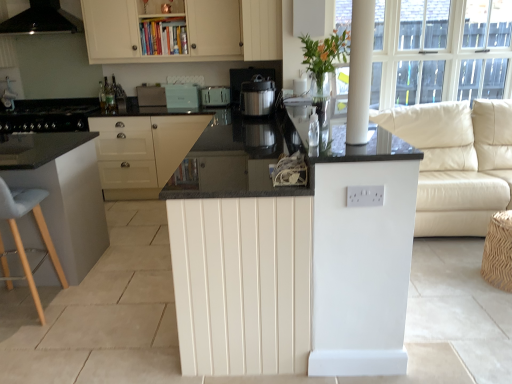
You are a GUI agent. You are given a task and a screenshot of the screen. Output one action in this format:
    pyautogui.click(x=<x>, y=<y>)
    Task: Click on the white glossy pillar at upper right
    The width and height of the screenshot is (512, 384).
    Given the screenshot: What is the action you would take?
    pyautogui.click(x=360, y=71)

Image resolution: width=512 pixels, height=384 pixels. What do you see at coordinates (257, 96) in the screenshot? I see `metallic silver coffee maker at center` at bounding box center [257, 96].

What do you see at coordinates (182, 96) in the screenshot?
I see `teal matte toaster at upper center, which ranks as the 3th appliance in left-to-right order` at bounding box center [182, 96].

This screenshot has height=384, width=512. I want to click on black glass stove at left, which ranks as the first appliance in left-to-right order, so click(48, 115).

Identify the location of brown woven stool at lower right, positioned as the 2th bar stool in left-to-right order. (498, 251).

Does translucent glass vase at upper center lie in front of white wood cabinet at upper center, the second cabinetry positioned from the top?

Yes, the depth of translucent glass vase at upper center is less than that of white wood cabinet at upper center, the second cabinetry positioned from the top.

Which is further, (x=345, y=30) or (x=268, y=28)?

The point (x=268, y=28) is farther.

In the scene shown: Would you say translucent glass vase at upper center is to the left or to the right of white wood cabinet at upper center, positioned as the 2th cabinetry in bottom-to-top order, in the picture?

translucent glass vase at upper center is to the right of white wood cabinet at upper center, positioned as the 2th cabinetry in bottom-to-top order.

From the image's perspective, between white glossy pillar at upper right and black glass stove at left, acting as the 4th appliance starting from the right, who is located below?

white glossy pillar at upper right appears lower in the image.

In the scene shown: Which object is positioned more to the left, white glossy pillar at upper right or black glass stove at left, which ranks as the first appliance in left-to-right order?

Positioned to the left is black glass stove at left, which ranks as the first appliance in left-to-right order.

Are white glossy pillar at upper right and black glass stove at left, which ranks as the first appliance in left-to-right order, beside each other?

No, white glossy pillar at upper right is not in contact with black glass stove at left, which ranks as the first appliance in left-to-right order.

Does white glossy pillar at upper right have a lesser height compared to black glass stove at left, acting as the 4th appliance starting from the right?

No, white glossy pillar at upper right is not shorter than black glass stove at left, acting as the 4th appliance starting from the right.

Is teal matte toaster at upper center, positioned as the second appliance in right-to-left order, outside of satin silver toaster at center, acting as the 4th appliance starting from the left?

Yes, teal matte toaster at upper center, positioned as the second appliance in right-to-left order, is outside of satin silver toaster at center, acting as the 4th appliance starting from the left.

Between teal matte toaster at upper center, positioned as the second appliance in right-to-left order, and satin silver toaster at center, acting as the 4th appliance starting from the left, which one has more height?

With more height is teal matte toaster at upper center, positioned as the second appliance in right-to-left order.

Looking at this image, from the image's perspective, which is below, teal matte toaster at upper center, positioned as the second appliance in right-to-left order, or satin silver toaster at center, which is counted as the 1th appliance, starting from the right?

From the image's view, satin silver toaster at center, which is counted as the 1th appliance, starting from the right, is below.

Considering the points (169, 92) and (209, 88), which point is behind, point (169, 92) or point (209, 88)?

The point (209, 88) is farther from the camera.

Does white glossy counter at center have a greater width compared to white plastic toaster at upper center, which ranks as the second appliance in left-to-right order?

Yes, white glossy counter at center is wider than white plastic toaster at upper center, which ranks as the second appliance in left-to-right order.

Considering the points (207, 344) and (162, 98), which point is behind, point (207, 344) or point (162, 98)?

Positioned behind is point (162, 98).

Is white glossy counter at center located outside white plastic toaster at upper center, which ranks as the second appliance in left-to-right order?

Yes, white glossy counter at center is located beyond the bounds of white plastic toaster at upper center, which ranks as the second appliance in left-to-right order.

From a real-world perspective, is white glossy pillar at upper right on top of white leather couch at right?

Yes, from a real-world perspective, white glossy pillar at upper right is on top of white leather couch at right.

Is white glossy pillar at upper right bigger or smaller than white leather couch at right?

In the image, white glossy pillar at upper right appears to be smaller than white leather couch at right.

Based on the photo, is the position of white glossy pillar at upper right more distant than that of white leather couch at right?

No, the depth of white glossy pillar at upper right is less than that of white leather couch at right.

Which is closer, [352,28] or [453,207]?

Clearly, point [352,28] is closer to the camera than point [453,207].

How many degrees apart are the facing directions of translucent glass vase at upper center and black matte range hood at upper left?

The angular difference between translucent glass vase at upper center and black matte range hood at upper left is 90.7 degrees.

Is translucent glass vase at upper center inside or outside of black matte range hood at upper left?

translucent glass vase at upper center is outside black matte range hood at upper left.

Find the location of `plant that appears in front of the black matte range hood at upper left`. plant that appears in front of the black matte range hood at upper left is located at coordinates (323, 55).

Is translucent glass vase at upper center bigger or smaller than black matte range hood at upper left?

translucent glass vase at upper center is smaller than black matte range hood at upper left.

Based on the photo, is light blue fabric stool at left, which is the first bar stool in left-to-right order, far away from white glossy pillar at upper right?

Absolutely, light blue fabric stool at left, which is the first bar stool in left-to-right order, is distant from white glossy pillar at upper right.

Is white glossy pillar at upper right a part of light blue fabric stool at left, which is the first bar stool in left-to-right order?

Actually, white glossy pillar at upper right is outside light blue fabric stool at left, which is the first bar stool in left-to-right order.

From the image's perspective, which one is positioned higher, light blue fabric stool at left, which is counted as the second bar stool, starting from the right, or white glossy pillar at upper right?

From the image's view, white glossy pillar at upper right is above.

Does light blue fabric stool at left, which is counted as the second bar stool, starting from the right, lie behind white glossy pillar at upper right?

Yes, light blue fabric stool at left, which is counted as the second bar stool, starting from the right, is further from the viewer.

Locate an element on the screen. the 1st cabinetry directly above the translucent glass vase at upper center (from a real-world perspective) is located at coordinates (261, 29).

Locate an element on the screen. The image size is (512, 384). the 1st appliance behind the white glossy pillar at upper right is located at coordinates (48, 115).

Based on their spatial positions, is white leather couch at right or satin silver toaster at center, which is counted as the 1th appliance, starting from the right, further from brown woven stool at lower right, positioned as the 2th bar stool in left-to-right order?

satin silver toaster at center, which is counted as the 1th appliance, starting from the right, lies further to brown woven stool at lower right, positioned as the 2th bar stool in left-to-right order, than the other object.

When comparing their distances from white matte cabinet at center, the 1th cabinetry in the bottom-to-top sequence, does teal matte toaster at upper center, positioned as the second appliance in right-to-left order, or white plastic toaster at upper center, which ranks as the second appliance in left-to-right order, seem further?

Among the two, teal matte toaster at upper center, positioned as the second appliance in right-to-left order, is located further to white matte cabinet at center, the 1th cabinetry in the bottom-to-top sequence.

Looking at the image, which one is located closer to matte cream cabinet at upper center, which appears as the first cabinetry when viewed from the top, white matte cabinet at center, the 1th cabinetry in the bottom-to-top sequence, or black matte range hood at upper left?

black matte range hood at upper left.

Estimate the real-world distances between objects in this image. Which object is further from white matte cabinet at center, which ranks as the 3th cabinetry in top-to-bottom order, white glossy pillar at upper right or translucent glass vase at upper center?

The object further to white matte cabinet at center, which ranks as the 3th cabinetry in top-to-bottom order, is white glossy pillar at upper right.

Considering their positions, is light blue fabric stool at left, which is the first bar stool in left-to-right order, positioned further to satin silver toaster at center, which is counted as the 1th appliance, starting from the right, than teal matte toaster at upper center, positioned as the second appliance in right-to-left order?

light blue fabric stool at left, which is the first bar stool in left-to-right order, lies further to satin silver toaster at center, which is counted as the 1th appliance, starting from the right, than the other object.

From the image, which object appears to be farther from teal matte toaster at upper center, which ranks as the 3th appliance in left-to-right order, light blue fabric stool at left, which is counted as the second bar stool, starting from the right, or satin silver toaster at center, which is counted as the 1th appliance, starting from the right?

light blue fabric stool at left, which is counted as the second bar stool, starting from the right.

From the picture: Looking at the image, which one is located further to white plastic toaster at upper center, which ranks as the second appliance in left-to-right order, satin silver toaster at center, acting as the 4th appliance starting from the left, or white wood cabinet at upper center, the second cabinetry positioned from the top?

white wood cabinet at upper center, the second cabinetry positioned from the top, lies further to white plastic toaster at upper center, which ranks as the second appliance in left-to-right order, than the other object.

From the image, which object appears to be nearer to teal matte toaster at upper center, which ranks as the 3th appliance in left-to-right order, white glossy pillar at upper right or white matte cabinet at center, the 1th cabinetry in the bottom-to-top sequence?

white matte cabinet at center, the 1th cabinetry in the bottom-to-top sequence, is positioned closer to the anchor teal matte toaster at upper center, which ranks as the 3th appliance in left-to-right order.

Locate an element on the screen. home appliance located between white glossy pillar at upper right and satin silver toaster at center, acting as the 4th appliance starting from the left, in the depth direction is located at coordinates (38, 19).

Locate an element on the screen. The height and width of the screenshot is (384, 512). studio couch positioned between white glossy counter at center and satin silver toaster at center, which is counted as the 1th appliance, starting from the right, from near to far is located at coordinates (457, 162).

At what (x,y) coordinates should I click in order to perform the action: click on plant between white glossy pillar at upper right and white plastic toaster at upper center, the third appliance positioned from the right, in the front-back direction. Please return your answer as a coordinate pair (x, y). Looking at the image, I should click on (323, 55).

I want to click on plant between light blue fabric stool at left, which is counted as the second bar stool, starting from the right, and brown woven stool at lower right, the first bar stool viewed from the right, so click(323, 55).